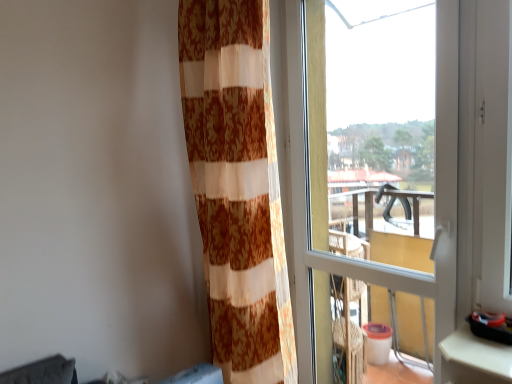
Question: Considering the positions of orange floral sheer curtain at center and transparent glass window at right in the image, is orange floral sheer curtain at center wider or thinner than transparent glass window at right?

Choices:
 (A) wide
 (B) thin

Answer: (A)

Question: Considering the positions of point (203, 185) and point (454, 284), is point (203, 185) closer or farther from the camera than point (454, 284)?

Choices:
 (A) closer
 (B) farther

Answer: (B)

Question: Considering the positions of orange floral sheer curtain at center and transparent glass window at right in the image, is orange floral sheer curtain at center taller or shorter than transparent glass window at right?

Choices:
 (A) tall
 (B) short

Answer: (B)

Question: From a real-world perspective, is transparent glass window at right positioned above or below orange floral sheer curtain at center?

Choices:
 (A) above
 (B) below

Answer: (B)

Question: Does point (321, 269) appear closer or farther from the camera than point (287, 347)?

Choices:
 (A) farther
 (B) closer

Answer: (A)

Question: In the image, is transparent glass window at right positioned in front of or behind orange floral sheer curtain at center?

Choices:
 (A) front
 (B) behind

Answer: (A)

Question: In the image, is transparent glass window at right on the left side or the right side of orange floral sheer curtain at center?

Choices:
 (A) right
 (B) left

Answer: (A)